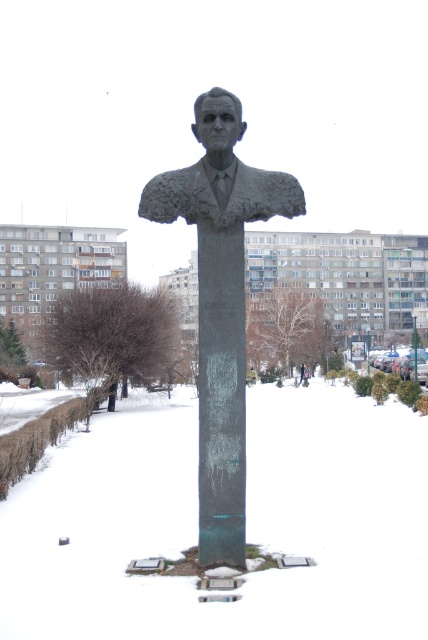
Which of these two, white frosty snow at center or bronze statue at center, stands shorter?

Standing shorter between the two is bronze statue at center.

Is point (247, 612) farther from camera compared to point (220, 205)?

No, (247, 612) is closer to viewer.

Identify the location of white frosty snow at center. This screenshot has width=428, height=640. coord(246,524).

Is green patina bust at center smaller than bronze statue at center?

Incorrect, green patina bust at center is not smaller in size than bronze statue at center.

Image resolution: width=428 pixels, height=640 pixels. Describe the element at coordinates (220, 304) in the screenshot. I see `green patina bust at center` at that location.

Locate an element on the screen. This screenshot has width=428, height=640. green patina bust at center is located at coordinates (220, 304).

Looking at this image, who is shorter, white frosty snow at center or green patina bust at center?

Standing shorter between the two is white frosty snow at center.

Based on the photo, does white frosty snow at center have a lesser height compared to green patina bust at center?

Correct, white frosty snow at center is not as tall as green patina bust at center.

The width and height of the screenshot is (428, 640). Find the location of `white frosty snow at center`. white frosty snow at center is located at coordinates (246, 524).